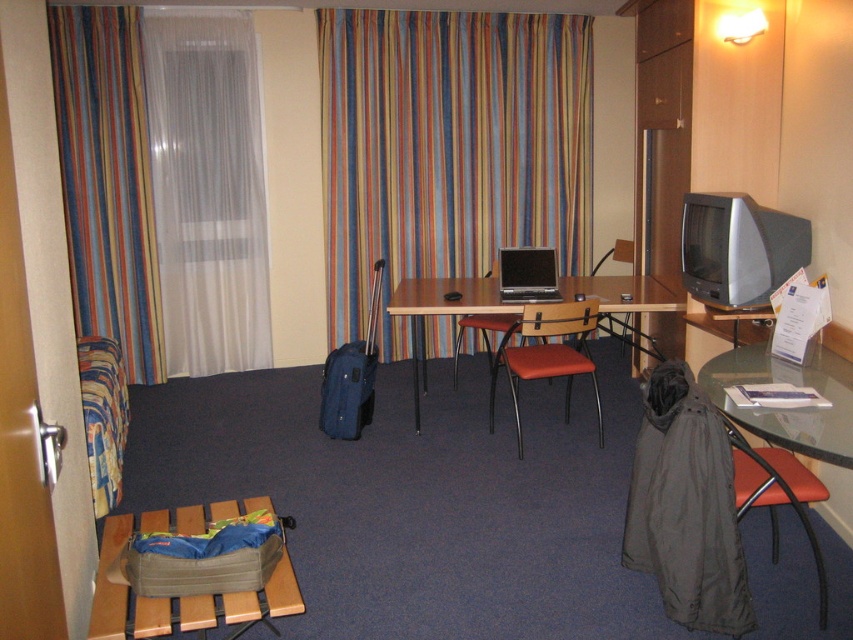
Question: Can you confirm if white sheer curtain at left is bigger than leatherette chair at center?

Choices:
 (A) yes
 (B) no

Answer: (A)

Question: Is transparent glass table at lower right positioned before matte orange chair at center?

Choices:
 (A) no
 (B) yes

Answer: (B)

Question: Which point is closer to the camera?

Choices:
 (A) (416, 424)
 (B) (85, 74)
 (C) (711, 566)
 (D) (498, 273)

Answer: (C)

Question: Is matte black laptop at center below matte plastic chair at center?

Choices:
 (A) no
 (B) yes

Answer: (A)

Question: Which of the following is the farthest from the observer?

Choices:
 (A) (630, 259)
 (B) (225, 621)

Answer: (A)

Question: Among these points, which one is nearest to the camera?

Choices:
 (A) (486, 337)
 (B) (637, 515)
 (C) (125, 241)

Answer: (B)